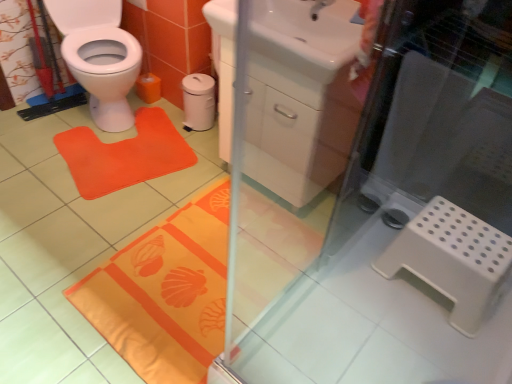
What is the approximate width of transparent glass screen door at upper center?

transparent glass screen door at upper center is 1.23 meters in width.

This screenshot has height=384, width=512. Describe the element at coordinates (403, 223) in the screenshot. I see `transparent glass screen door at upper center` at that location.

Measure the distance between point (x=463, y=226) and camera.

Point (x=463, y=226) and camera are 5.00 feet apart.

The width and height of the screenshot is (512, 384). Describe the element at coordinates (165, 293) in the screenshot. I see `orange fabric bath mat at lower center` at that location.

Where is `orange fabric bath mat at lower center`? orange fabric bath mat at lower center is located at coordinates [165, 293].

At what (x,y) coordinates should I click in order to perform the action: click on transparent glass screen door at upper center. Please return your answer as a coordinate pair (x, y). Looking at the image, I should click on (403, 223).

Does point (111, 150) come behind point (239, 352)?

Yes, it is.

From a real-world perspective, is orange fabric mat at left on top of transparent glass screen door at upper center?

No, from a real-world perspective, orange fabric mat at left is not on top of transparent glass screen door at upper center.

From the image's perspective, would you say orange fabric mat at left is shown under transparent glass screen door at upper center?

No, from the image's perspective, orange fabric mat at left is not below transparent glass screen door at upper center.

Does point (446, 83) appear closer or farther from the camera than point (224, 295)?

Point (446, 83) is positioned closer to the camera compared to point (224, 295).

From a real-world perspective, between transparent glass screen door at upper center and orange fabric bath mat at lower center, who is vertically higher?

From a 3D spatial view, transparent glass screen door at upper center is above.

Is orange fabric bath mat at lower center surrounded by transparent glass screen door at upper center?

No, orange fabric bath mat at lower center is located outside of transparent glass screen door at upper center.

In the scene shown: Can you confirm if white glossy sink at upper center is positioned to the left of matte white tap at upper center?

Yes.

Which is in front, point (340, 95) or point (316, 11)?

The point (340, 95) is more forward.

Is white glossy sink at upper center behind matte white tap at upper center?

No, white glossy sink at upper center is in front of matte white tap at upper center.

Does white glossy sink at upper center have a larger size compared to transparent glass screen door at upper center?

Incorrect, white glossy sink at upper center is not larger than transparent glass screen door at upper center.

Considering the relative sizes of white glossy sink at upper center and transparent glass screen door at upper center in the image provided, is white glossy sink at upper center taller than transparent glass screen door at upper center?

No, white glossy sink at upper center is not taller than transparent glass screen door at upper center.

From the image's perspective, is white glossy sink at upper center on transparent glass screen door at upper center?

Yes, from the image's perspective, white glossy sink at upper center is above transparent glass screen door at upper center.

How many degrees apart are the facing directions of white glossy sink at upper center and transparent glass screen door at upper center?

1.25 degrees.

Which object is thinner, transparent glass screen door at upper center or orange fabric mat at left?

With smaller width is orange fabric mat at left.

Does transparent glass screen door at upper center have a larger size compared to orange fabric mat at left?

Correct, transparent glass screen door at upper center is larger in size than orange fabric mat at left.

In the scene shown: From the image's perspective, between transparent glass screen door at upper center and orange fabric mat at left, which one is located above?

From the image's view, orange fabric mat at left is above.

Which of these two, transparent glass screen door at upper center or orange fabric mat at left, stands shorter?

orange fabric mat at left.

From a real-world perspective, does orange fabric mat at left sit lower than white matte trash can at center?

Yes, from a real-world perspective, orange fabric mat at left is under white matte trash can at center.

From the picture: Between orange fabric mat at left and white matte trash can at center, which one has larger size?

orange fabric mat at left is bigger.

Which of these two, orange fabric mat at left or white matte trash can at center, is wider?

orange fabric mat at left is wider.

From the image's perspective, which one is positioned higher, orange fabric mat at left or white matte trash can at center?

white matte trash can at center is shown above in the image.

Relative to white plastic step stool at lower right, is transparent glass screen door at upper center in front or behind?

Clearly, transparent glass screen door at upper center is in front of white plastic step stool at lower right.

Which is in front, point (475, 214) or point (407, 229)?

The point (407, 229) is more forward.

How far apart are transparent glass screen door at upper center and white plastic step stool at lower right?

They are 6.51 inches apart.

Is transparent glass screen door at upper center wider or thinner than white plastic step stool at lower right?

In the image, transparent glass screen door at upper center appears to be wider than white plastic step stool at lower right.

I want to click on yoga mat behind the transparent glass screen door at upper center, so click(124, 154).

Image resolution: width=512 pixels, height=384 pixels. Identify the location of screen door above the orange fabric bath mat at lower center (from a real-world perspective). (403, 223).

When comparing their distances from white glossy sink at upper center, does white matte trash can at center or orange fabric bath mat at lower center seem further?

white matte trash can at center.

When comparing their distances from white plastic step stool at lower right, does orange fabric bath mat at lower center or matte white tap at upper center seem further?

matte white tap at upper center lies further to white plastic step stool at lower right than the other object.

Which object lies further to the anchor point orange fabric mat at left, transparent glass screen door at upper center or matte white tap at upper center?

matte white tap at upper center lies further to orange fabric mat at left than the other object.

Looking at this image, looking at the image, which one is located closer to white plastic step stool at lower right, transparent glass screen door at upper center or white matte trash can at center?

transparent glass screen door at upper center.

Which object lies nearer to the anchor point matte white tap at upper center, transparent glass screen door at upper center or orange fabric mat at left?

transparent glass screen door at upper center is closer to matte white tap at upper center.

Looking at this image, from the image, which object appears to be nearer to orange fabric mat at left, white matte trash can at center or white glossy sink at upper center?

Among the two, white matte trash can at center is located nearer to orange fabric mat at left.

From the image, which object appears to be nearer to orange fabric mat at left, white glossy sink at upper center or white plastic step stool at lower right?

white glossy sink at upper center lies closer to orange fabric mat at left than the other object.

Which object lies further to the anchor point white plastic step stool at lower right, matte white tap at upper center or transparent glass screen door at upper center?

matte white tap at upper center lies further to white plastic step stool at lower right than the other object.

Identify the location of step stool between transparent glass screen door at upper center and matte white tap at upper center from front to back. This screenshot has width=512, height=384. (453, 260).

At what (x,y) coordinates should I click in order to perform the action: click on toilet paper between matte white tap at upper center and white plastic step stool at lower right in the vertical direction. Please return your answer as a coordinate pair (x, y). Looking at the image, I should click on (198, 102).

Locate an element on the screen. yoga mat between matte white tap at upper center and orange fabric bath mat at lower center from top to bottom is located at coordinates (124, 154).

Find the location of a particular element. toilet paper between orange fabric mat at left and white glossy sink at upper center in the horizontal direction is located at coordinates (198, 102).